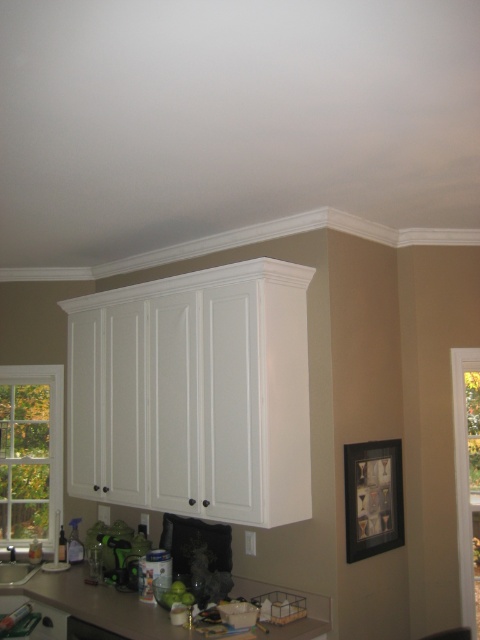
You are organizing items on the matte brown countertop at lower center. Where exactly is this countertop positioned in the kitchen scene?

The matte brown countertop at lower center is located at point coordinates of 0.945 on the x axis and 0.204 on the y axis.

You are a kitchen designer planning to place a new appliance that requires 6 inches of clearance between the matte brown countertop at lower center and the black matte dishwasher at lower center. Based on the current layout, is there enough space?

The matte brown countertop at lower center and black matte dishwasher at lower center are 5.41 inches apart, which is less than the required 6 inches of clearance. Therefore, there is not enough space for the new appliance with the required clearance.

You are a delivery person holding a large package that requires placing on a surface. You are standing in front of the kitchen scene and see the matte brown countertop at lower center. Can you estimate whether the countertop is within a comfortable reach distance of 10 feet for placing the package?

The matte brown countertop at lower center is 8.75 feet away from the camera, which is within the comfortable reach distance of 10 feet. Therefore, you can comfortably place the package on the matte brown countertop at lower center.